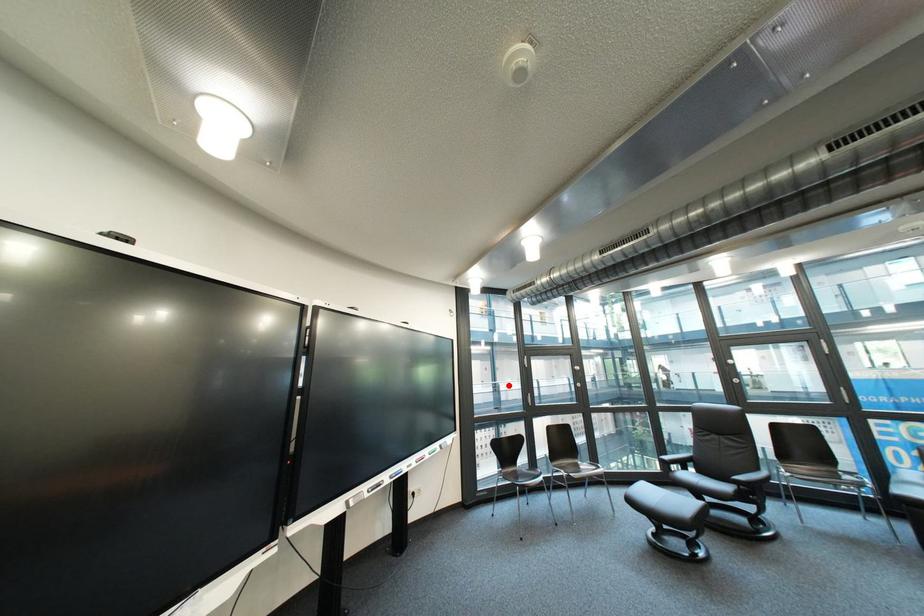
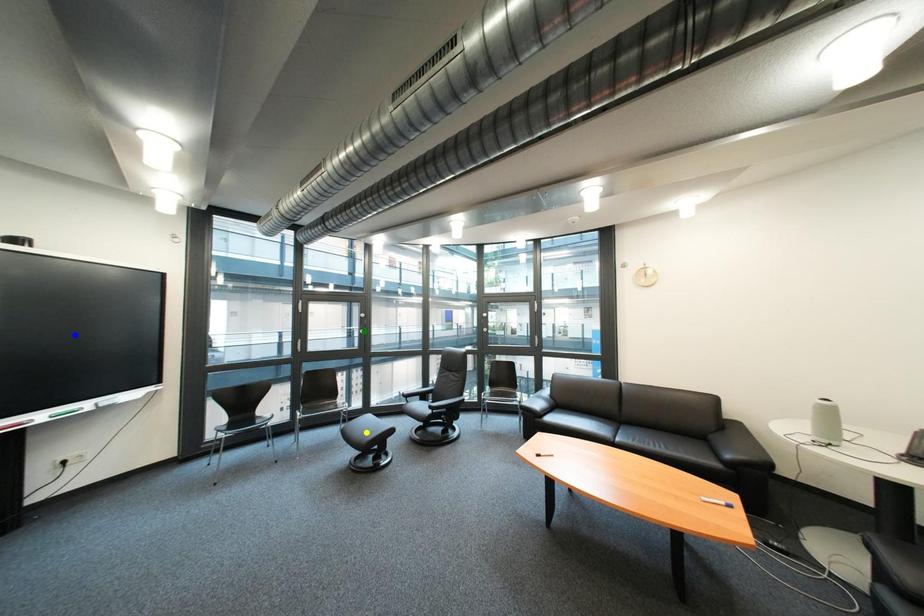
Question: I am providing you with two images of the same scene from different viewpoints. A red point is marked on the first image. You are given multiple points on the second image. Which spot in image 2 lines up with the point in image 1?

Choices:
 (A) blue point
 (B) yellow point
 (C) green point

Answer: (C)